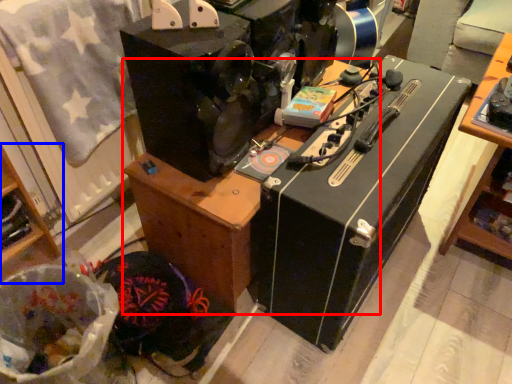
Question: Which point is further to the camera, furniture (highlighted by a red box) or furniture (highlighted by a blue box)?

Choices:
 (A) furniture
 (B) furniture

Answer: (A)